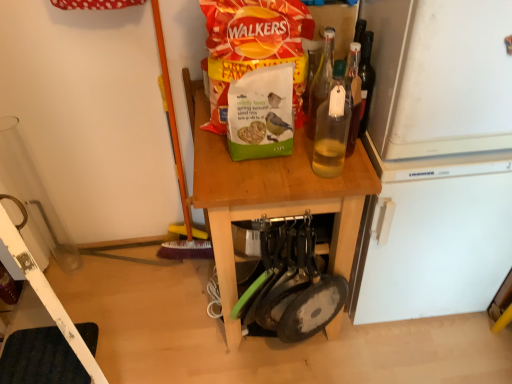
Locate an element on the screen. free space between wooden table at center and white plastic ladder at lower left is located at coordinates (158, 318).